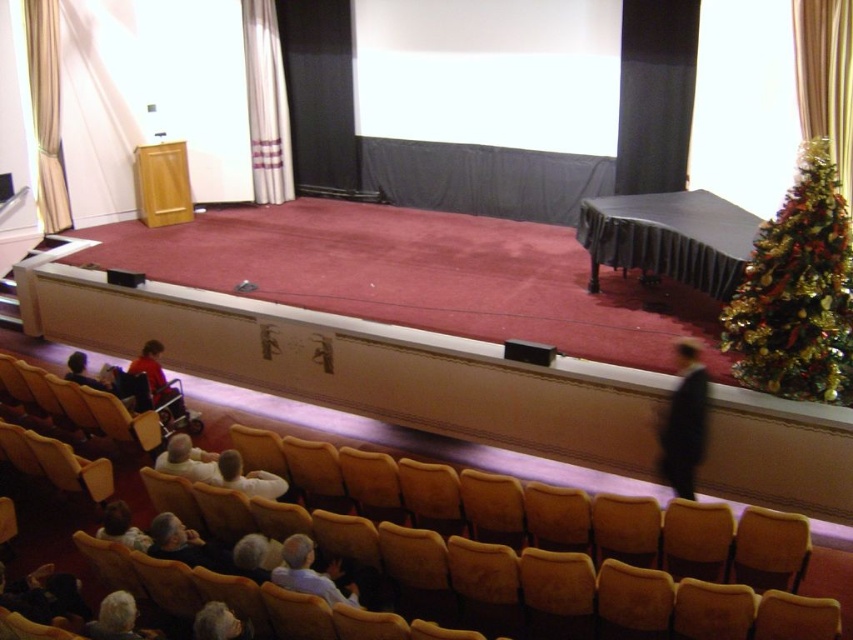
Is the position of gold textured curtain at left less distant than that of light brown leather jacket at lower left?

No, it is behind light brown leather jacket at lower left.

Which is above, gold textured curtain at left or light brown leather jacket at lower left?

gold textured curtain at left is higher up.

Measure the distance between gold textured curtain at left and camera.

gold textured curtain at left and camera are 28.88 feet apart.

I want to click on gold textured curtain at left, so click(45, 109).

Can you confirm if gray hair at lower left is smaller than matte red shirt at center?

Indeed, gray hair at lower left has a smaller size compared to matte red shirt at center.

Does gray hair at lower left appear on the right side of matte red shirt at center?

Indeed, gray hair at lower left is positioned on the right side of matte red shirt at center.

Is point (144, 632) positioned before point (157, 349)?

Yes, point (144, 632) is closer to viewer.

At what (x,y) coordinates should I click in order to perform the action: click on gray hair at lower left. Please return your answer as a coordinate pair (x, y). Image resolution: width=853 pixels, height=640 pixels. Looking at the image, I should click on (115, 618).

Who is taller, green shiny christmas tree at right or white fabric shirt at lower center?

green shiny christmas tree at right is taller.

Which is in front, point (782, 289) or point (229, 483)?

Point (229, 483) is more forward.

The height and width of the screenshot is (640, 853). Describe the element at coordinates (798, 292) in the screenshot. I see `green shiny christmas tree at right` at that location.

This screenshot has height=640, width=853. I want to click on green shiny christmas tree at right, so click(x=798, y=292).